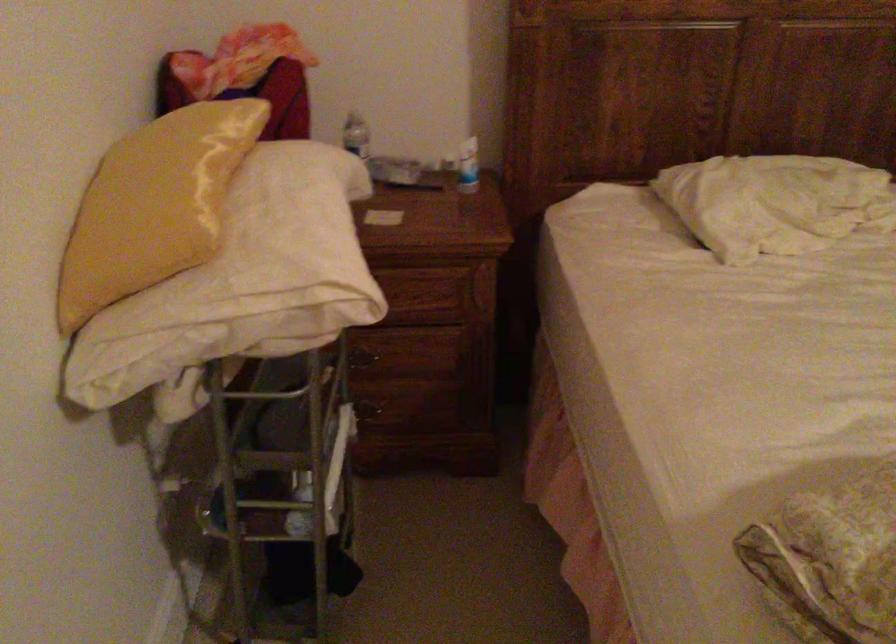
The location [153,205] corresponds to which object?

It refers to a yellow pillow.